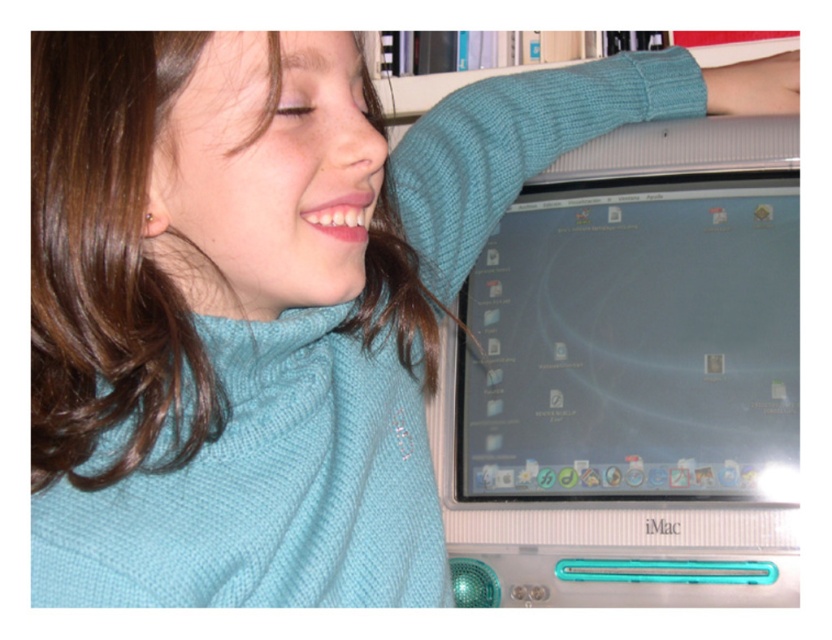
Is teal knitted sleeve at upper right to the left of white paperbacks at upper center from the viewer's perspective?

No, teal knitted sleeve at upper right is not to the left of white paperbacks at upper center.

From the picture: Which of these two, teal knitted sleeve at upper right or white paperbacks at upper center, stands shorter?

teal knitted sleeve at upper right is shorter.

You are a GUI agent. You are given a task and a screenshot of the screen. Output one action in this format:
    pyautogui.click(x=<x>, y=<y>)
    Task: Click on the teal knitted sleeve at upper right
    This screenshot has width=832, height=640.
    Given the screenshot: What is the action you would take?
    pyautogui.click(x=754, y=86)

Between point (672, 296) and point (443, 77), which one is positioned in front?

Point (672, 296)

Locate an element on the screen. satin silver monitor at center is located at coordinates coord(634,342).

You are a GUI agent. You are given a task and a screenshot of the screen. Output one action in this format:
    pyautogui.click(x=<x>, y=<y>)
    Task: Click on the satin silver monitor at center
    
    Given the screenshot: What is the action you would take?
    pyautogui.click(x=634, y=342)

Is satin silver monitor at center further to camera compared to teal knitted sleeve at upper right?

No, it is in front of teal knitted sleeve at upper right.

Which is more to the left, satin silver monitor at center or teal knitted sleeve at upper right?

satin silver monitor at center is more to the left.

Which is in front, point (689, 266) or point (746, 93)?

Positioned in front is point (689, 266).

At what (x,y) coordinates should I click in order to perform the action: click on satin silver monitor at center. Please return your answer as a coordinate pair (x, y). This screenshot has height=640, width=832. Looking at the image, I should click on (634, 342).